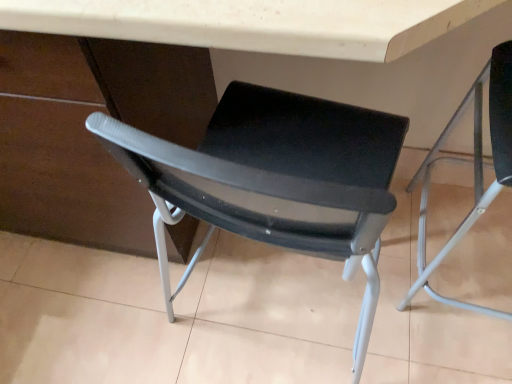
Find the location of a particular element. Image resolution: width=512 pixels, height=384 pixels. free point below matte black chair at right, acting as the 2th chair starting from the left (from a real-world perspective) is located at coordinates (482, 266).